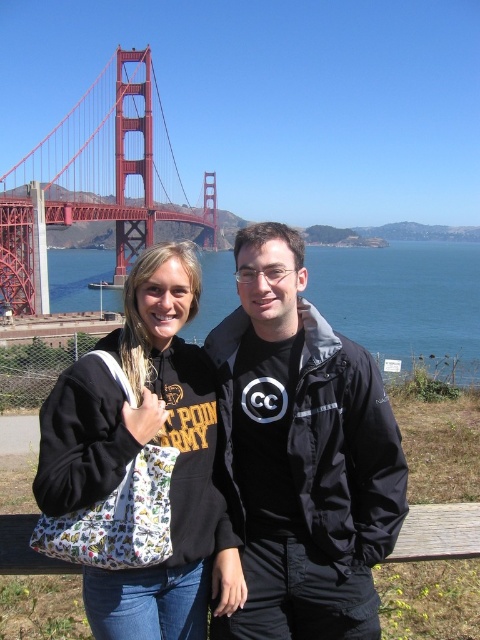
Question: Which point is farther to the camera?

Choices:
 (A) (97, 579)
 (B) (336, 273)

Answer: (B)

Question: Which of these objects is positioned closest to the printed fabric tote bag at center?

Choices:
 (A) red painted steel bridge at upper left
 (B) black matte jacket at center

Answer: (B)

Question: Which of the following is the farthest from the observer?

Choices:
 (A) (274, 396)
 (B) (154, 228)
 (C) (207, 584)
 (D) (420, 353)

Answer: (B)

Question: Can you confirm if black matte jacket at center is thinner than blue water at center?

Choices:
 (A) no
 (B) yes

Answer: (B)

Question: Can you confirm if printed fabric tote bag at center is positioned to the left of red painted steel bridge at upper left?

Choices:
 (A) yes
 (B) no

Answer: (B)

Question: Can you confirm if black matte jacket at center is smaller than red painted steel bridge at upper left?

Choices:
 (A) yes
 (B) no

Answer: (A)